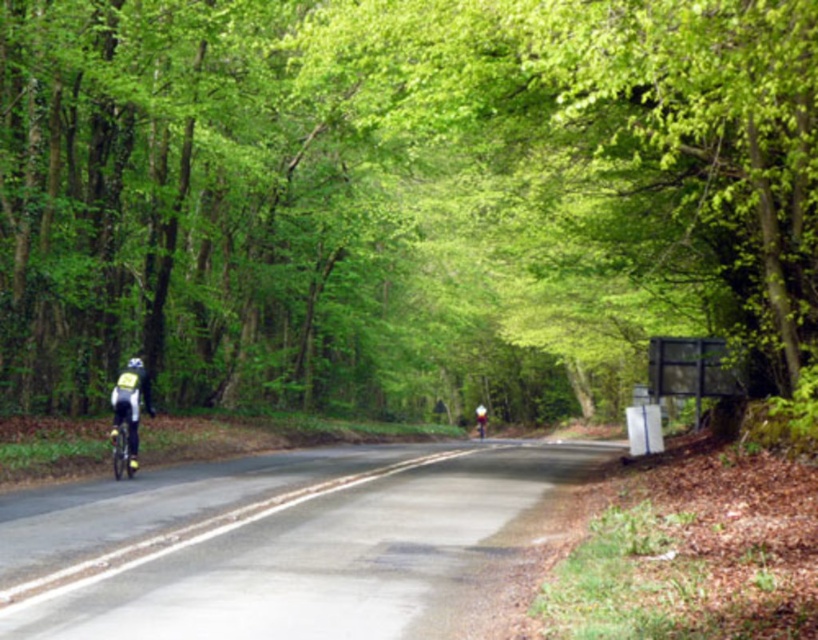
You are a cyclist navigating a curved road surrounded by trees. You notice two points marked on your GPS. The first point is at point (479,432) and the second point is at point (133,365). Which point should you aim for first if you want to reach the destination in the correct order?

You should aim for point (133,365) first because point (479,432) is behind it, so following the correct order requires reaching the first point before the second one.

You are a pedestrian observing two helmets on the road. The matte black helmet at center and the white matte bicycle helmet at left. Which helmet is taller?

The matte black helmet at center has a greater height compared to the white matte bicycle helmet at left, so the matte black helmet at center is taller.